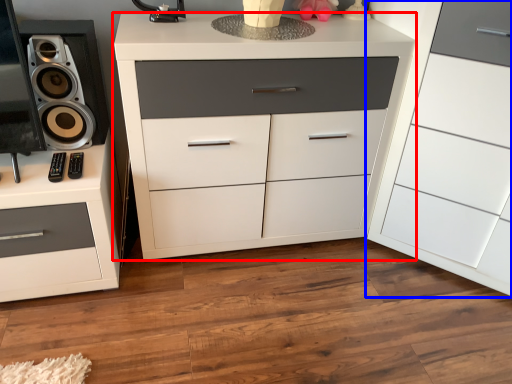
Question: Which of the following is the farthest to the observer, chest of drawers (highlighted by a red box) or chest of drawers (highlighted by a blue box)?

Choices:
 (A) chest of drawers
 (B) chest of drawers

Answer: (A)